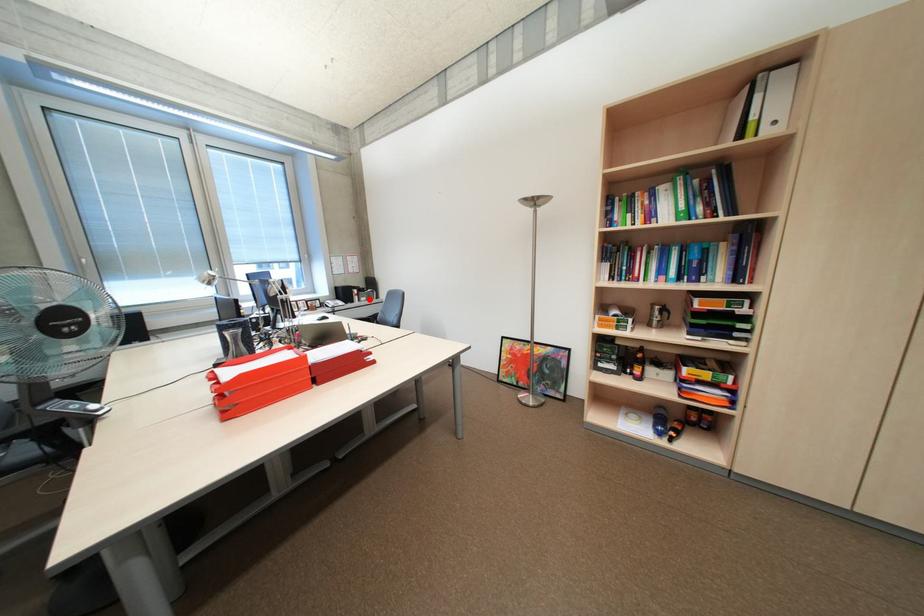
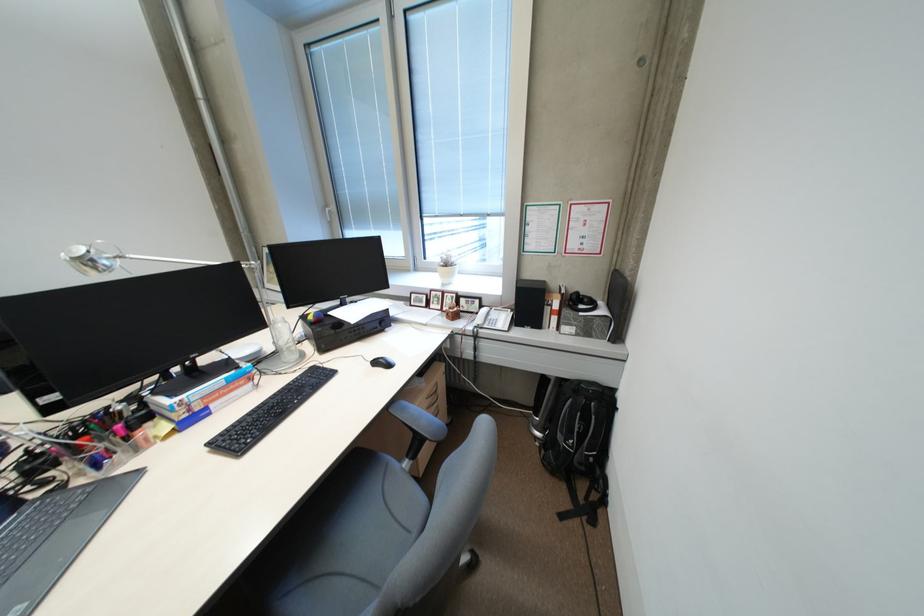
Question: A red point is marked in image1. In image2, is the corresponding 3D point closer to the camera or farther? Reply with the corresponding letter.

Choices:
 (A) The corresponding 3D point is closer.
 (B) The corresponding 3D point is farther.

Answer: (A)